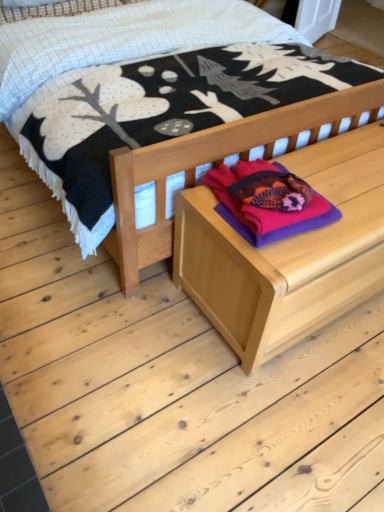
Question: Is natural wood bed at center behind wooden chest at center?

Choices:
 (A) yes
 (B) no

Answer: (B)

Question: Is natural wood bed at center outside of wooden chest at center?

Choices:
 (A) yes
 (B) no

Answer: (A)

Question: Considering the relative sizes of natural wood bed at center and wooden chest at center in the image provided, is natural wood bed at center wider than wooden chest at center?

Choices:
 (A) no
 (B) yes

Answer: (B)

Question: Can you confirm if natural wood bed at center is positioned to the right of wooden chest at center?

Choices:
 (A) no
 (B) yes

Answer: (A)

Question: Is natural wood bed at center positioned in front of wooden chest at center?

Choices:
 (A) no
 (B) yes

Answer: (B)

Question: In terms of width, does purple fleece sweater at center look wider or thinner when compared to natural wood bed at center?

Choices:
 (A) thin
 (B) wide

Answer: (A)

Question: From a real-world perspective, is purple fleece sweater at center positioned above or below natural wood bed at center?

Choices:
 (A) above
 (B) below

Answer: (B)

Question: Is point (307, 185) closer or farther from the camera than point (79, 86)?

Choices:
 (A) farther
 (B) closer

Answer: (B)

Question: Is purple fleece sweater at center in front of or behind natural wood bed at center in the image?

Choices:
 (A) behind
 (B) front

Answer: (A)

Question: From their relative heights in the image, would you say wooden chest at center is taller or shorter than purple fleece sweater at center?

Choices:
 (A) short
 (B) tall

Answer: (B)

Question: Is point (177, 239) closer or farther from the camera than point (249, 181)?

Choices:
 (A) closer
 (B) farther

Answer: (B)

Question: In terms of size, does wooden chest at center appear bigger or smaller than purple fleece sweater at center?

Choices:
 (A) big
 (B) small

Answer: (A)

Question: Is wooden chest at center inside or outside of purple fleece sweater at center?

Choices:
 (A) outside
 (B) inside

Answer: (A)

Question: Looking at the image, does natural wood bed at center seem bigger or smaller compared to wooden chest at center?

Choices:
 (A) small
 (B) big

Answer: (B)

Question: From the image's perspective, is natural wood bed at center positioned above or below wooden chest at center?

Choices:
 (A) below
 (B) above

Answer: (B)